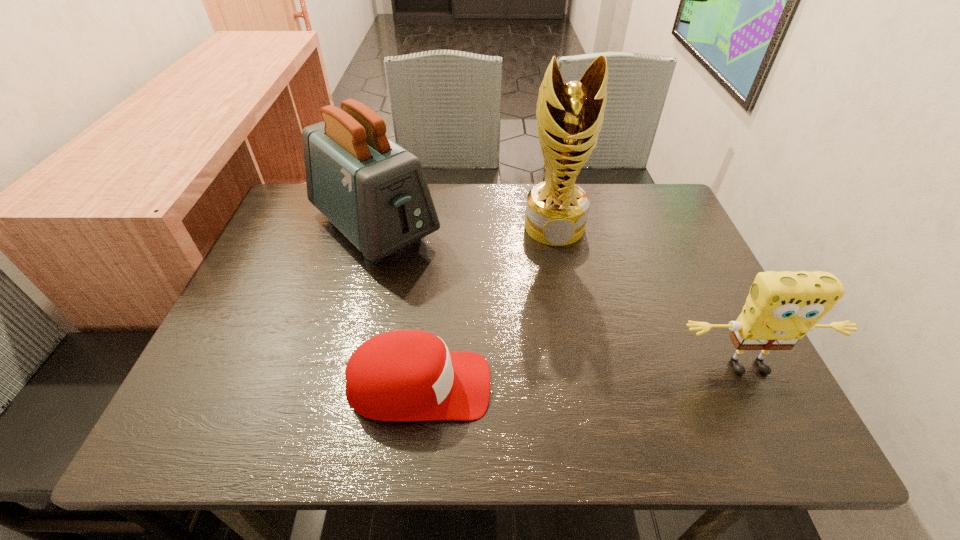
Identify the location of free spot located on the front-facing side of the toaster. (493, 335).

In order to click on vacant space situated 0.330m on the front-facing side of the toaster in this screenshot , I will do `click(503, 343)`.

The width and height of the screenshot is (960, 540). What are the coordinates of `free space located 0.200m on the front-facing side of the toaster` in the screenshot? It's located at (464, 309).

The image size is (960, 540). I want to click on award at the far edge, so click(x=569, y=117).

Find the location of `toaster present at the far edge`. toaster present at the far edge is located at coordinates (375, 192).

This screenshot has height=540, width=960. Identify the location of baseball cap present at the near edge. (405, 375).

What are the coordinates of `sponge present at the near edge` in the screenshot? It's located at (781, 308).

Find the location of a particular element. This screenshot has height=540, width=960. object located in the left edge section of the desktop is located at coordinates (375, 192).

Locate an element on the screen. The width and height of the screenshot is (960, 540). object present at the right edge is located at coordinates click(781, 308).

Where is `object located at the far left corner`? object located at the far left corner is located at coordinates (375, 192).